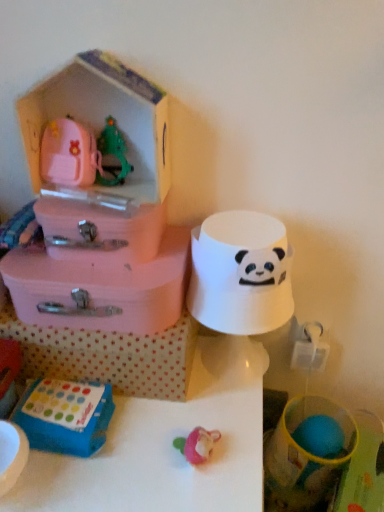
You are a GUI agent. You are given a task and a screenshot of the screen. Output one action in this format:
    pyautogui.click(x=<x>, y=<y>)
    Task: Click on the vacant space that is in between pink plastic storage box at upper left, the fourth storage box in the top-to-bottom sequence, and blue plastic toy at lower left, positioned as the 2th toy in top-to-bottom order
    The height and width of the screenshot is (512, 384).
    Given the screenshot: What is the action you would take?
    pyautogui.click(x=138, y=432)